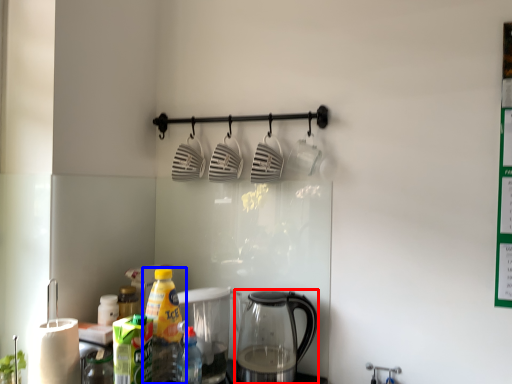
Question: Which object appears farthest to the camera in this image, kettle (highlighted by a red box) or bottle (highlighted by a blue box)?

Choices:
 (A) kettle
 (B) bottle

Answer: (A)